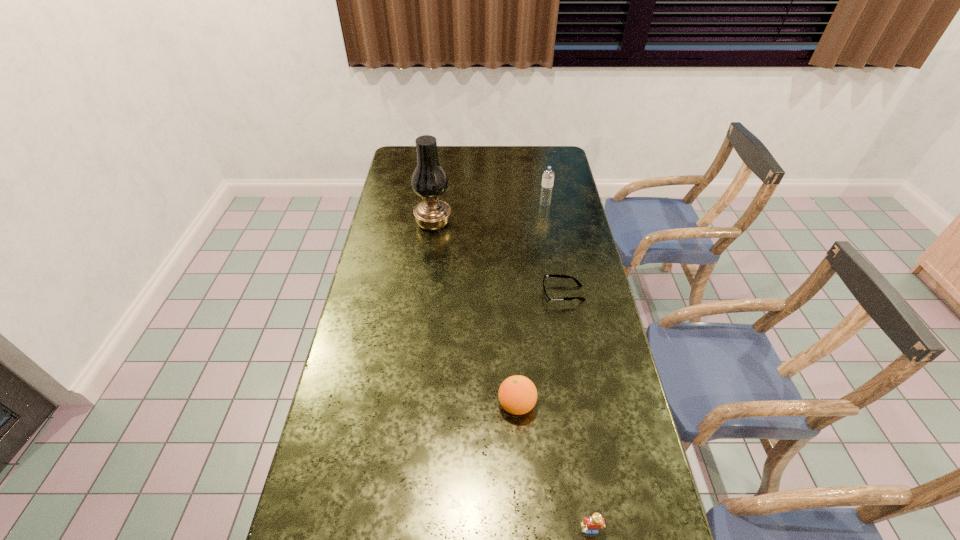
Where is `vacant space at the far edge`? This screenshot has height=540, width=960. vacant space at the far edge is located at coordinates (470, 163).

Where is `free location at the left edge`? free location at the left edge is located at coordinates (389, 204).

Locate an element on the screen. The image size is (960, 540). vacant space at the right edge of the desktop is located at coordinates (563, 196).

In the image, there is a desktop. Where is `vacant region at the far left corner`? This screenshot has width=960, height=540. vacant region at the far left corner is located at coordinates (406, 151).

Where is `vacant space at the far right corner`? The width and height of the screenshot is (960, 540). vacant space at the far right corner is located at coordinates (534, 151).

The height and width of the screenshot is (540, 960). I want to click on vacant space that's between the Lego and the water bottle, so click(568, 367).

Where is `vacant area between the fourth object from right to left and the Lego`? vacant area between the fourth object from right to left and the Lego is located at coordinates (554, 467).

Where is `free space between the Lego and the sunglasses`? free space between the Lego and the sunglasses is located at coordinates (577, 411).

At what (x,y) coordinates should I click in order to perform the action: click on free point between the Lego and the third nearest object. Please return your answer as a coordinate pair (x, y). Looking at the image, I should click on (577, 411).

Where is `empty space between the water bottle and the fourth tallest object`? This screenshot has width=960, height=540. empty space between the water bottle and the fourth tallest object is located at coordinates (568, 367).